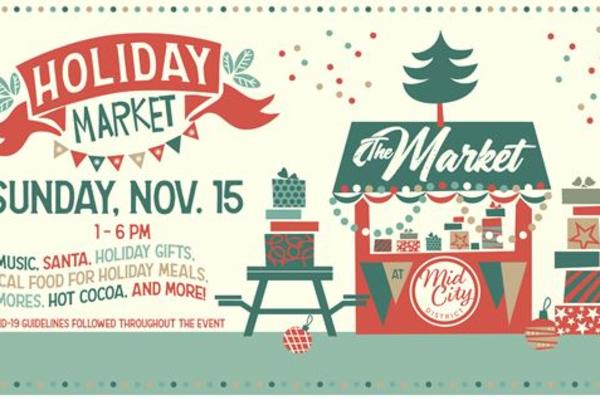
This screenshot has width=600, height=400. In order to click on christmas ornaments in this screenshot , I will do `click(296, 340)`, `click(545, 333)`.